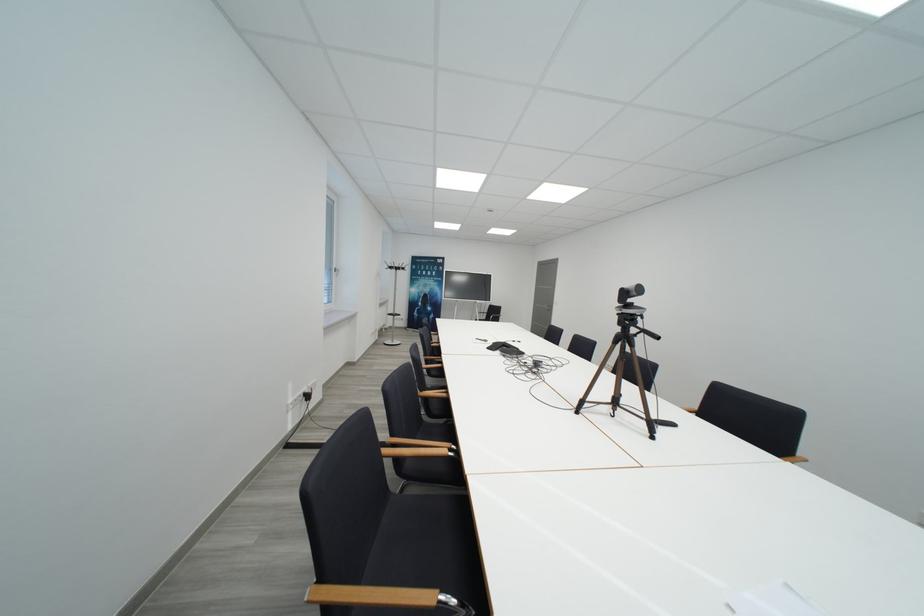
I want to click on coat stand hook, so click(394, 265).